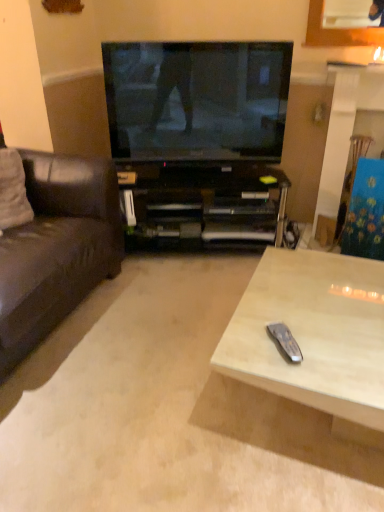
The height and width of the screenshot is (512, 384). Find the location of `blank space situated above wooden coffee table at center (from a real-world perspective)`. blank space situated above wooden coffee table at center (from a real-world perspective) is located at coordinates (182, 357).